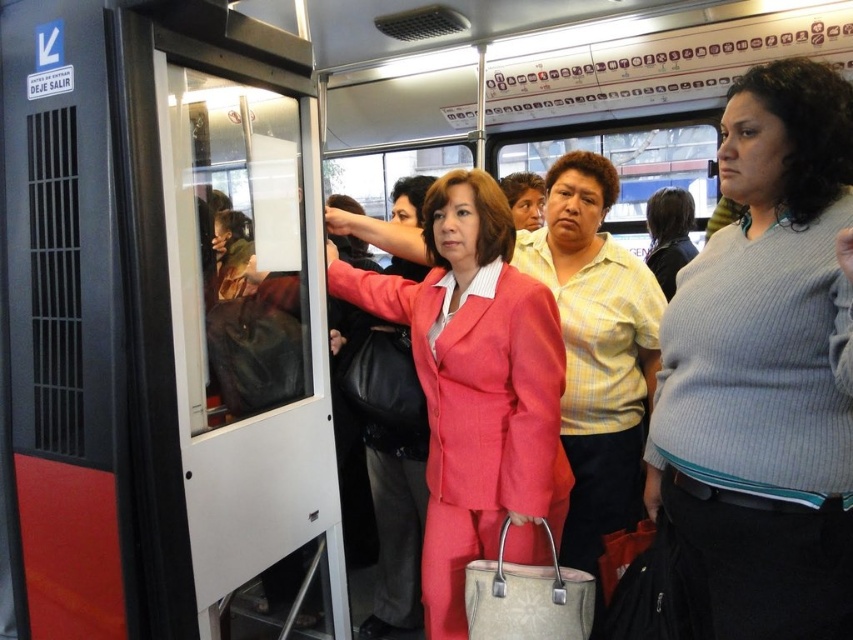
Please describe the location of the ribbed gray sweater at right relative to the point marked at coordinates (764, 372).

The ribbed gray sweater at right is exactly at the point marked at coordinates (764, 372).